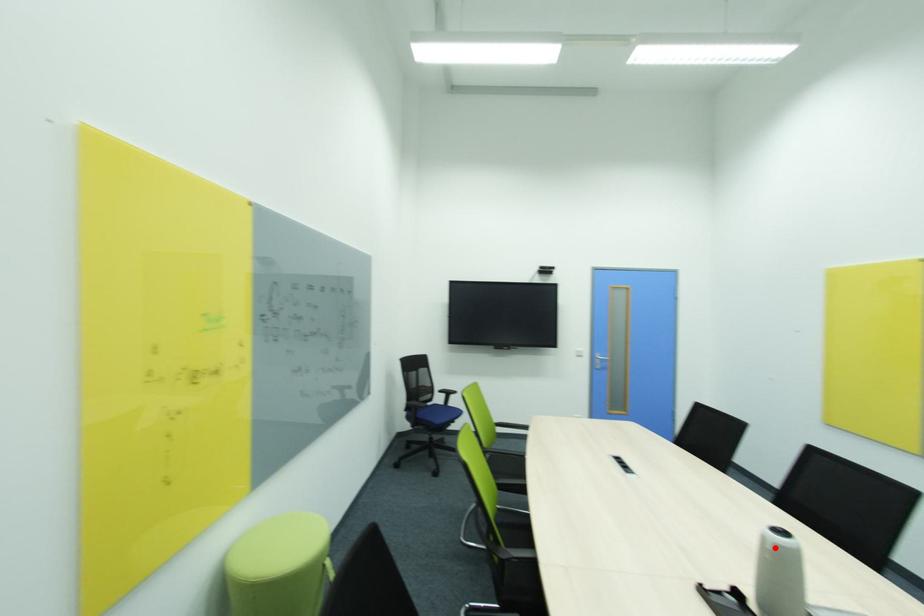
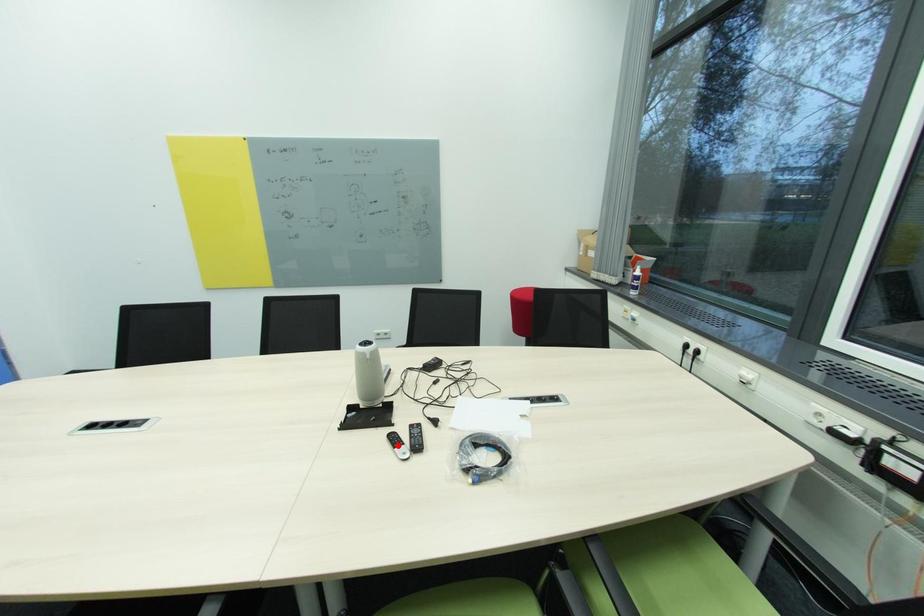
I am providing you with two images of the same scene from different viewpoints. A red point is marked on the first image and another point is marked on the second image. Does the point marked in image1 correspond to the same location as the one in image2?

No